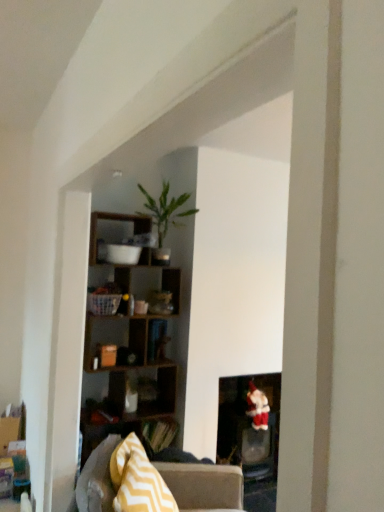
Question: Is gray fabric couch at center not inside matte black fireplace at lower right?

Choices:
 (A) yes
 (B) no

Answer: (A)

Question: Considering the relative sizes of gray fabric couch at center and matte black fireplace at lower right in the image provided, is gray fabric couch at center thinner than matte black fireplace at lower right?

Choices:
 (A) no
 (B) yes

Answer: (A)

Question: Considering the relative sizes of gray fabric couch at center and matte black fireplace at lower right in the image provided, is gray fabric couch at center smaller than matte black fireplace at lower right?

Choices:
 (A) yes
 (B) no

Answer: (B)

Question: Is gray fabric couch at center at the left side of matte black fireplace at lower right?

Choices:
 (A) yes
 (B) no

Answer: (A)

Question: From a real-world perspective, is gray fabric couch at center on matte black fireplace at lower right?

Choices:
 (A) no
 (B) yes

Answer: (B)

Question: Is point (182, 506) positioned closer to the camera than point (142, 472)?

Choices:
 (A) farther
 (B) closer

Answer: (A)

Question: Choose the correct answer: Is gray fabric couch at center inside yellow zigzag fabric pillow at lower left or outside it?

Choices:
 (A) inside
 (B) outside

Answer: (B)

Question: Would you say gray fabric couch at center is to the left or to the right of yellow zigzag fabric pillow at lower left in the picture?

Choices:
 (A) left
 (B) right

Answer: (B)

Question: Relative to yellow zigzag fabric pillow at lower left, is gray fabric couch at center in front or behind?

Choices:
 (A) front
 (B) behind

Answer: (A)

Question: In terms of width, does gray fabric couch at center look wider or thinner when compared to wooden cube shelf at upper center?

Choices:
 (A) wide
 (B) thin

Answer: (A)

Question: Is point (94, 475) positioned closer to the camera than point (117, 379)?

Choices:
 (A) closer
 (B) farther

Answer: (A)

Question: Relative to wooden cube shelf at upper center, is gray fabric couch at center in front or behind?

Choices:
 (A) behind
 (B) front

Answer: (B)

Question: Is gray fabric couch at center situated inside wooden cube shelf at upper center or outside?

Choices:
 (A) inside
 (B) outside

Answer: (B)

Question: Is point (94, 239) positioned closer to the camera than point (152, 259)?

Choices:
 (A) closer
 (B) farther

Answer: (A)

Question: Considering the positions of wooden cube shelf at upper center and green matte plant at upper center in the image, is wooden cube shelf at upper center taller or shorter than green matte plant at upper center?

Choices:
 (A) tall
 (B) short

Answer: (A)